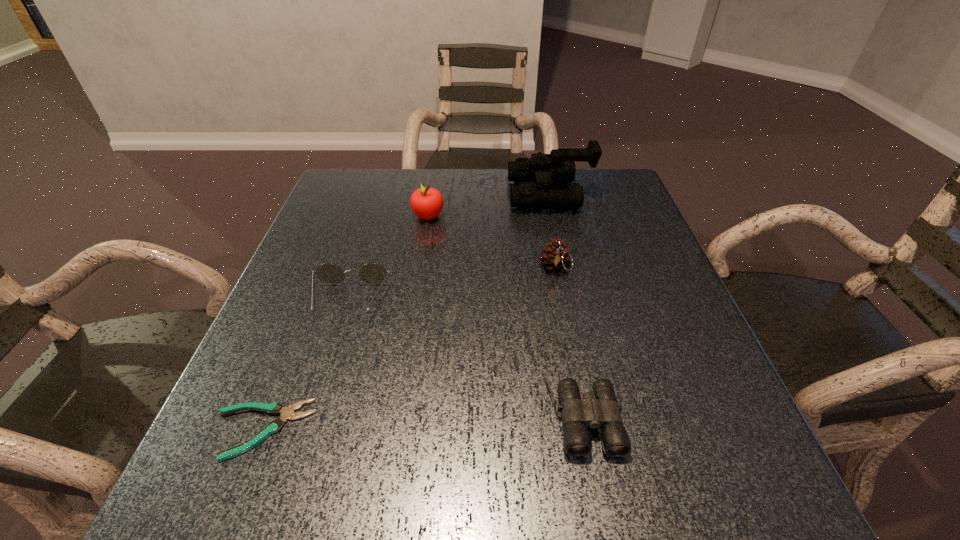
At what (x,y) coordinates should I click in order to perform the action: click on the taller binoculars. Please return your answer as a coordinate pair (x, y). This screenshot has width=960, height=540. Looking at the image, I should click on (559, 166).

Identify the location of the farther binoculars. The image size is (960, 540). (559, 166).

Where is `the fifth shortest object`? the fifth shortest object is located at coordinates (427, 203).

Where is `the fourth object from right to left`? The image size is (960, 540). the fourth object from right to left is located at coordinates (427, 203).

Where is `the fourth nearest object`? Image resolution: width=960 pixels, height=540 pixels. the fourth nearest object is located at coordinates (556, 257).

Where is `pinecone`? pinecone is located at coordinates (556, 257).

Where is `the fourth farthest object`? The width and height of the screenshot is (960, 540). the fourth farthest object is located at coordinates (372, 273).

Where is `spectacles`? This screenshot has width=960, height=540. spectacles is located at coordinates (372, 273).

Where is `the second shortest object`? This screenshot has width=960, height=540. the second shortest object is located at coordinates (599, 409).

This screenshot has width=960, height=540. I want to click on the nearer binoculars, so click(599, 409).